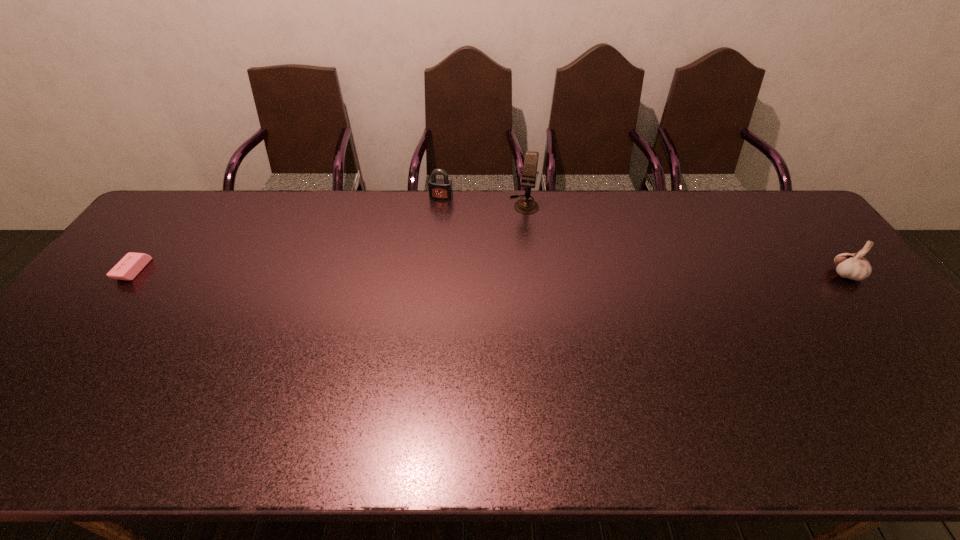
Identify the location of vacant spot on the desktop that is between the shortest object and the garlic and is positioned on the front-facing side of the microphone. click(x=507, y=273).

Find the location of a particular element. The image size is (960, 540). free space on the desktop that is between the leftmost object and the garlic and is positioned on the front of the second object from left to right near the keyhole is located at coordinates (413, 272).